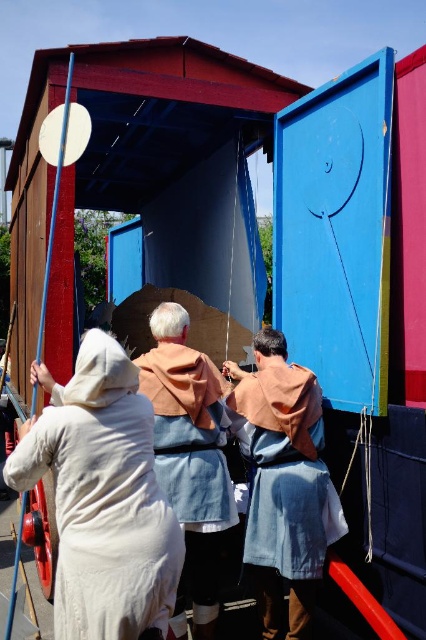
Question: Does white cotton dress at lower left have a greater width compared to denim fabric robe at center?

Choices:
 (A) yes
 (B) no

Answer: (A)

Question: Among these points, which one is farthest from the camera?

Choices:
 (A) (100, 492)
 (B) (149, 323)
 (C) (287, 413)

Answer: (B)

Question: Does denim fabric robe at center have a smaller size compared to white linen dress at center?

Choices:
 (A) no
 (B) yes

Answer: (A)

Question: Is white cotton dress at lower left above white linen dress at center?

Choices:
 (A) yes
 (B) no

Answer: (A)

Question: Among these objects, which one is nearest to the camera?

Choices:
 (A) white cotton dress at lower left
 (B) white linen dress at center
 (C) denim fabric robe at center

Answer: (A)

Question: Which object is the farthest from the denim fabric robe at center?

Choices:
 (A) white cotton dress at lower left
 (B) white linen dress at center

Answer: (A)